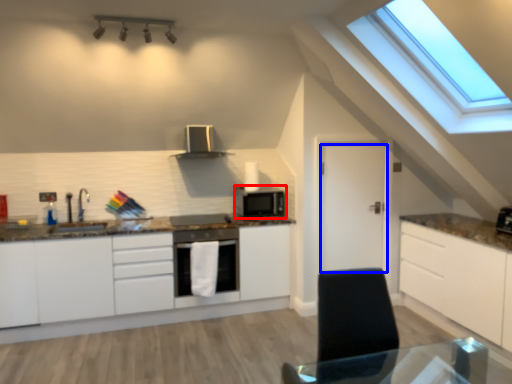
Question: Which object appears farthest to the camera in this image, microwave oven (highlighted by a red box) or door (highlighted by a blue box)?

Choices:
 (A) microwave oven
 (B) door

Answer: (A)